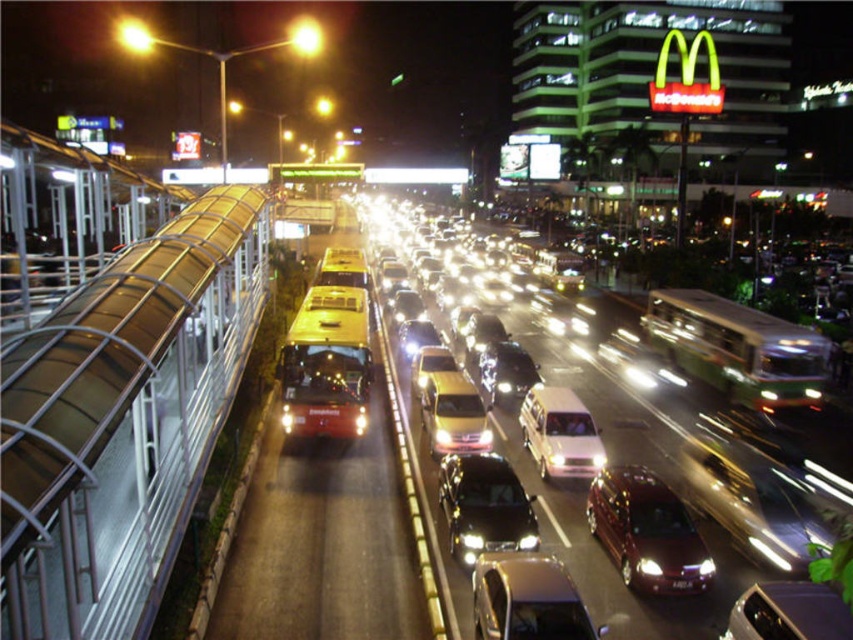
Question: Which point is farther to the camera?

Choices:
 (A) shiny black sedan at center
 (B) satin burgundy minivan at center

Answer: (B)

Question: Estimate the real-world distances between objects in this image. Which object is farther from the metallic gold taxi at center?

Choices:
 (A) shiny black sedan at center
 (B) yellow metallic taxi at center
 (C) white matte taxi at center
 (D) satin black sedan at center

Answer: (A)

Question: Where is yellow metallic bus at center located in relation to satin black sedan at center in the image?

Choices:
 (A) above
 (B) below

Answer: (A)

Question: Does satin black sedan at center have a smaller size compared to shiny silver car at lower right?

Choices:
 (A) yes
 (B) no

Answer: (B)

Question: Does shiny black sedan at center appear over metallic gold taxi at center?

Choices:
 (A) yes
 (B) no

Answer: (B)

Question: Which point is closer to the camera?

Choices:
 (A) satin burgundy minivan at center
 (B) white matte taxi at center
 (C) shiny silver car at lower right

Answer: (C)